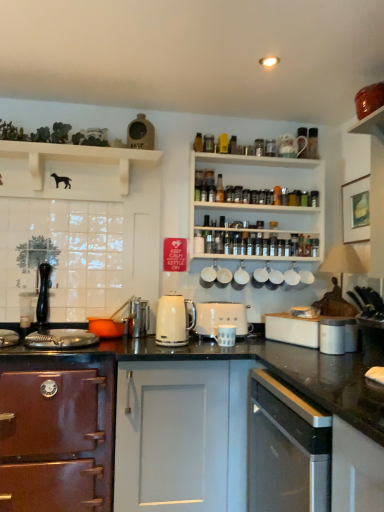
Image resolution: width=384 pixels, height=512 pixels. I want to click on free space in front of cream matte electric kettle at center, so click(x=183, y=349).